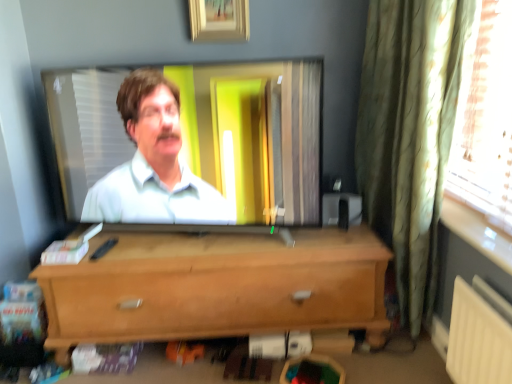
Question: Is light brown wood chest of drawers at center bigger than green textured curtain at right?

Choices:
 (A) yes
 (B) no

Answer: (A)

Question: Considering the relative positions of light brown wood chest of drawers at center and green textured curtain at right in the image provided, is light brown wood chest of drawers at center behind green textured curtain at right?

Choices:
 (A) yes
 (B) no

Answer: (A)

Question: Is green textured curtain at right at the back of light brown wood chest of drawers at center?

Choices:
 (A) yes
 (B) no

Answer: (B)

Question: Is light brown wood chest of drawers at center completely or partially outside of green textured curtain at right?

Choices:
 (A) yes
 (B) no

Answer: (A)

Question: From the image's perspective, is light brown wood chest of drawers at center on top of green textured curtain at right?

Choices:
 (A) yes
 (B) no

Answer: (B)

Question: Is wooden picture frame at upper center to the left or to the right of light brown wood chest of drawers at center in the image?

Choices:
 (A) right
 (B) left

Answer: (A)

Question: Which is correct: wooden picture frame at upper center is inside light brown wood chest of drawers at center, or outside of it?

Choices:
 (A) outside
 (B) inside

Answer: (A)

Question: In terms of size, does wooden picture frame at upper center appear bigger or smaller than light brown wood chest of drawers at center?

Choices:
 (A) small
 (B) big

Answer: (A)

Question: From the image's perspective, is wooden picture frame at upper center located above or below light brown wood chest of drawers at center?

Choices:
 (A) below
 (B) above

Answer: (B)

Question: Is light brown wood chest of drawers at center in front of or behind green textured curtain at right in the image?

Choices:
 (A) behind
 (B) front

Answer: (A)

Question: Is point (154, 314) closer or farther from the camera than point (414, 225)?

Choices:
 (A) closer
 (B) farther

Answer: (B)

Question: In terms of height, does light brown wood chest of drawers at center look taller or shorter compared to green textured curtain at right?

Choices:
 (A) short
 (B) tall

Answer: (A)

Question: Visually, is light brown wood chest of drawers at center positioned to the left or to the right of green textured curtain at right?

Choices:
 (A) right
 (B) left

Answer: (B)

Question: In terms of width, does green textured curtain at right look wider or thinner when compared to wooden picture frame at upper center?

Choices:
 (A) wide
 (B) thin

Answer: (A)

Question: Considering the positions of point (360, 94) and point (244, 36), is point (360, 94) closer or farther from the camera than point (244, 36)?

Choices:
 (A) farther
 (B) closer

Answer: (A)